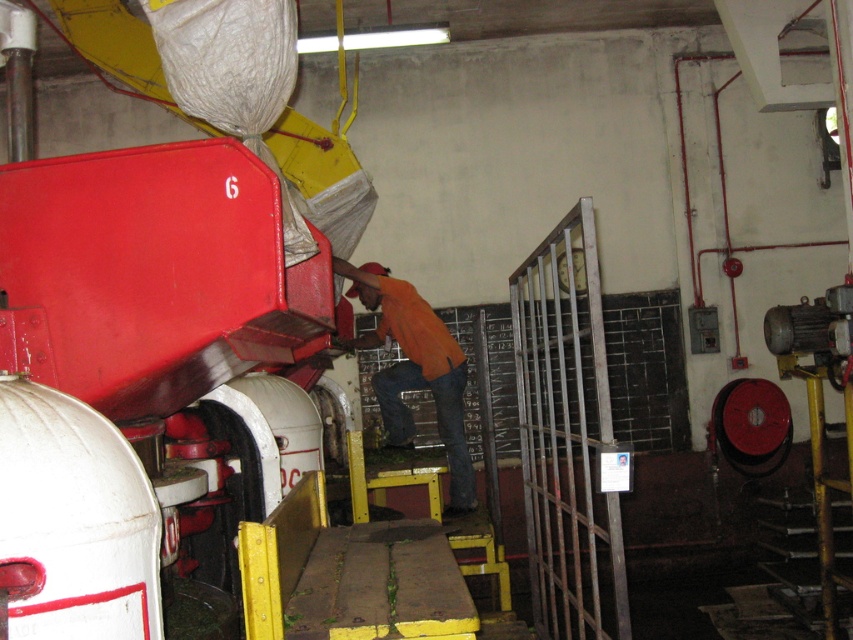
You are a maintenance worker needing to access the metallic gate at right. Given that your tool cart is 2.5 meters long, can you safely maneuver it towards the gate without hitting any obstacles?

The metallic gate at right is 2.79 meters away from the viewer. Since the tool cart is 2.5 meters long, there is sufficient space to maneuver it safely towards the gate as long as the path is clear of other obstacles.

You are a safety inspector in this industrial facility. You need to ensure that the orange fabric shirt at center is visible to workers passing by the metallic gate at right. Considering their heights, is the shirt likely to be obscured by the gate?

The metallic gate at right is much taller than the orange fabric shirt at center, so the shirt could be partially or fully obscured by the gate depending on the angle and distance, but since the gate is taller, there is a higher chance the shirt might not be visible from certain viewpoints.